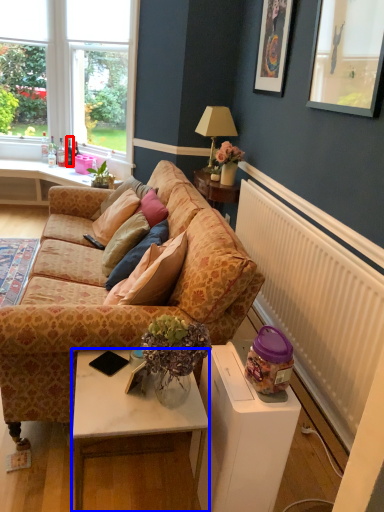
Question: Which of the following is the closest to the observer, bottle (highlighted by a red box) or table (highlighted by a blue box)?

Choices:
 (A) bottle
 (B) table

Answer: (B)